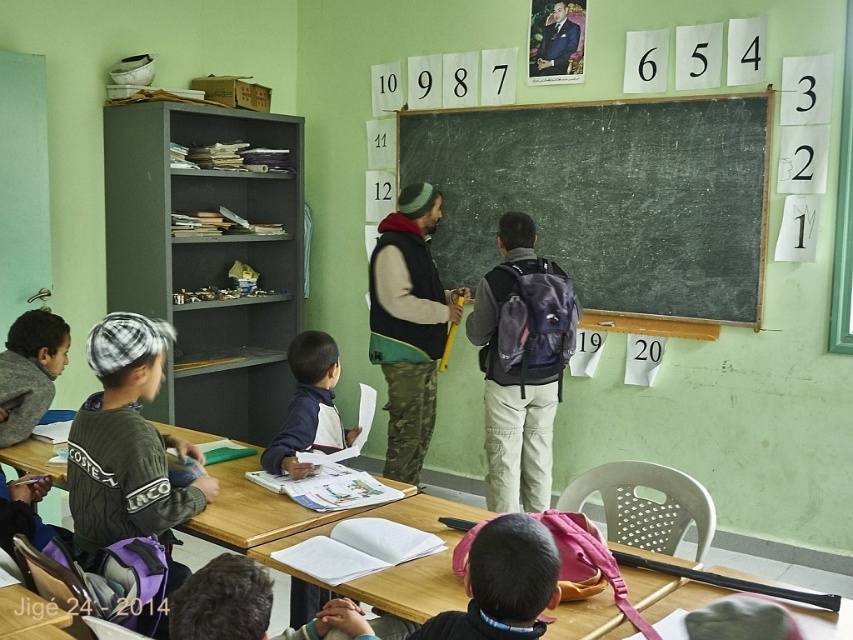
Which is behind, point (144, 387) or point (544, 381)?

Point (544, 381)

Where is `knitted green sweater at left`? Image resolution: width=853 pixels, height=640 pixels. knitted green sweater at left is located at coordinates (126, 442).

The image size is (853, 640). What do you see at coordinates (126, 442) in the screenshot?
I see `knitted green sweater at left` at bounding box center [126, 442].

I want to click on knitted green sweater at left, so click(x=126, y=442).

Describe the element at coordinates (294, 513) in the screenshot. I see `wooden table at center` at that location.

Who is higher up, wooden table at center or black matte backpack at center?

black matte backpack at center

Measure the distance between point (241, 509) and camera.

They are 2.23 meters apart.

Locate an element on the screen. wooden table at center is located at coordinates (294, 513).

Can you confirm if wooden table at center is shorter than navy blue jacket at center?

Yes, wooden table at center is shorter than navy blue jacket at center.

Does point (405, 500) come in front of point (318, 436)?

That is True.

Locate an element on the screen. wooden table at center is located at coordinates (294, 513).